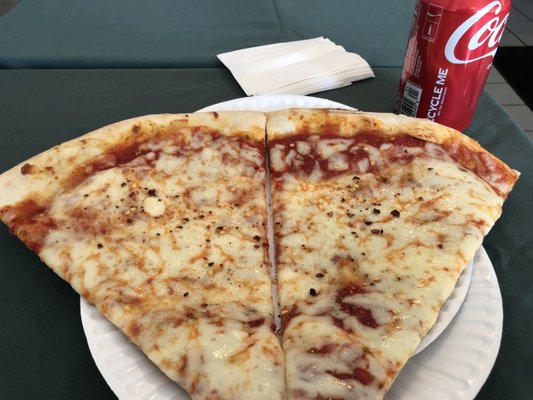
Image resolution: width=533 pixels, height=400 pixels. In order to click on paper plate in this screenshot , I will do `click(452, 374)`, `click(141, 376)`, `click(451, 309)`.